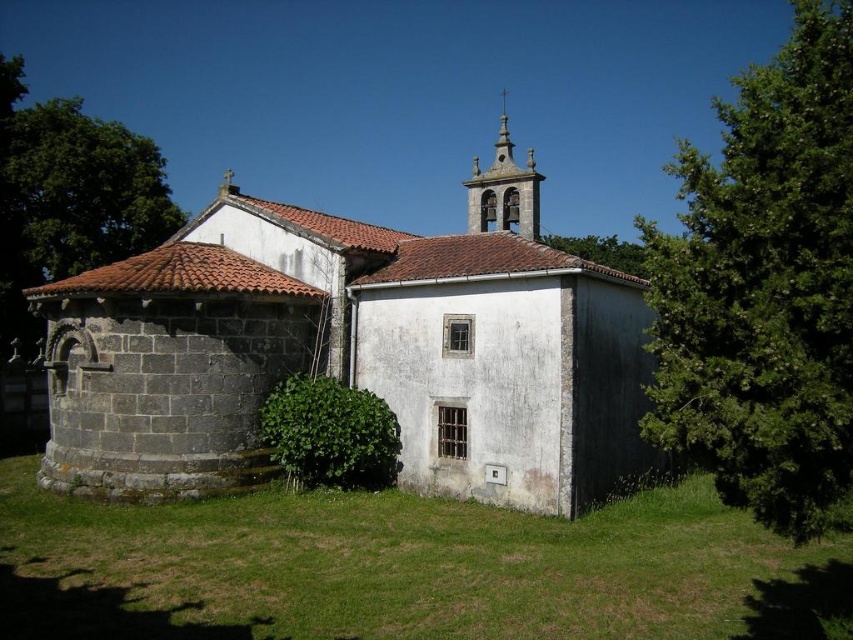
You are standing in the grassy area in front of the gray stone church at center. You want to take a photo of the church with the green leafy tree at upper left in the background. Will the tree appear larger or smaller than the church in the photo?

The gray stone church at center has a smaller size compared to green leafy tree at upper left. Since the tree is larger in reality and positioned behind the church, it will appear larger in the photo.

You are standing in front of the church and see the green leafy tree at right and the green leafy tree at upper left. Which tree is located more to the right side?

The green leafy tree at right is positioned on the right side of the green leafy tree at upper left, so it is more to the right side.

You are standing in front of the church and want to know which tree has a smaller width between the green leafy tree at right and the green leafy tree at upper left. Which one is it?

The green leafy tree at right is thinner than the green leafy tree at upper left, so the green leafy tree at right has a smaller width.